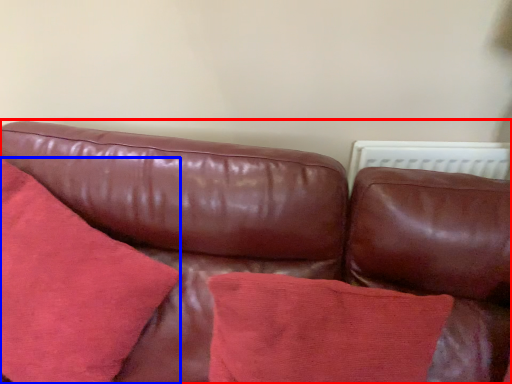
Question: Which point is closer to the camera, studio couch (highlighted by a red box) or throw pillow (highlighted by a blue box)?

Choices:
 (A) studio couch
 (B) throw pillow

Answer: (A)